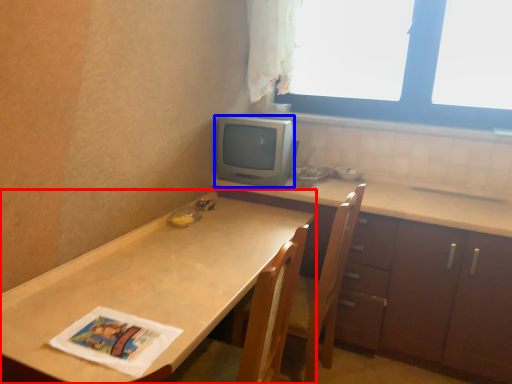
Question: Which of the following is the farthest to the observer, countertop (highlighted by a red box) or appliance (highlighted by a blue box)?

Choices:
 (A) countertop
 (B) appliance

Answer: (B)